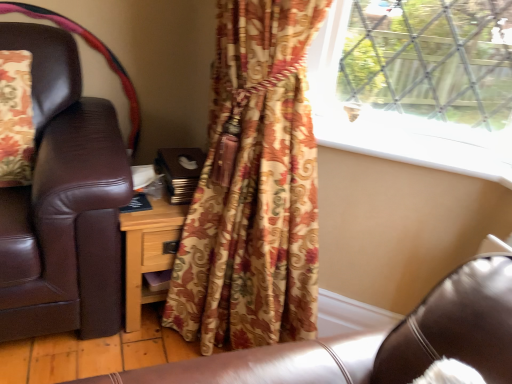
Question: Does wooden nightstand at center lie in front of white smooth window sill at upper center?

Choices:
 (A) yes
 (B) no

Answer: (B)

Question: Is white smooth window sill at upper center located within wooden nightstand at center?

Choices:
 (A) yes
 (B) no

Answer: (B)

Question: From a real-world perspective, is wooden nightstand at center below white smooth window sill at upper center?

Choices:
 (A) no
 (B) yes

Answer: (B)

Question: Is wooden nightstand at center facing away from white smooth window sill at upper center?

Choices:
 (A) yes
 (B) no

Answer: (B)

Question: Is wooden nightstand at center thinner than white smooth window sill at upper center?

Choices:
 (A) yes
 (B) no

Answer: (B)

Question: Would you say floral fabric curtain at center is to the left or to the right of wooden nightstand at center in the picture?

Choices:
 (A) left
 (B) right

Answer: (B)

Question: Looking at their shapes, would you say floral fabric curtain at center is wider or thinner than wooden nightstand at center?

Choices:
 (A) wide
 (B) thin

Answer: (A)

Question: Choose the correct answer: Is floral fabric curtain at center inside wooden nightstand at center or outside it?

Choices:
 (A) inside
 (B) outside

Answer: (B)

Question: From the image's perspective, relative to wooden nightstand at center, is floral fabric curtain at center above or below?

Choices:
 (A) above
 (B) below

Answer: (A)

Question: From their relative heights in the image, would you say wooden nightstand at center is taller or shorter than floral fabric curtain at center?

Choices:
 (A) tall
 (B) short

Answer: (B)

Question: From the image's perspective, relative to floral fabric curtain at center, is wooden nightstand at center above or below?

Choices:
 (A) below
 (B) above

Answer: (A)

Question: Is wooden nightstand at center to the left or to the right of floral fabric curtain at center in the image?

Choices:
 (A) left
 (B) right

Answer: (A)

Question: Is point (138, 284) closer or farther from the camera than point (272, 157)?

Choices:
 (A) farther
 (B) closer

Answer: (A)

Question: Looking at their shapes, would you say white smooth window sill at upper center is wider or thinner than wooden nightstand at center?

Choices:
 (A) thin
 (B) wide

Answer: (A)

Question: Is white smooth window sill at upper center taller or shorter than wooden nightstand at center?

Choices:
 (A) tall
 (B) short

Answer: (B)